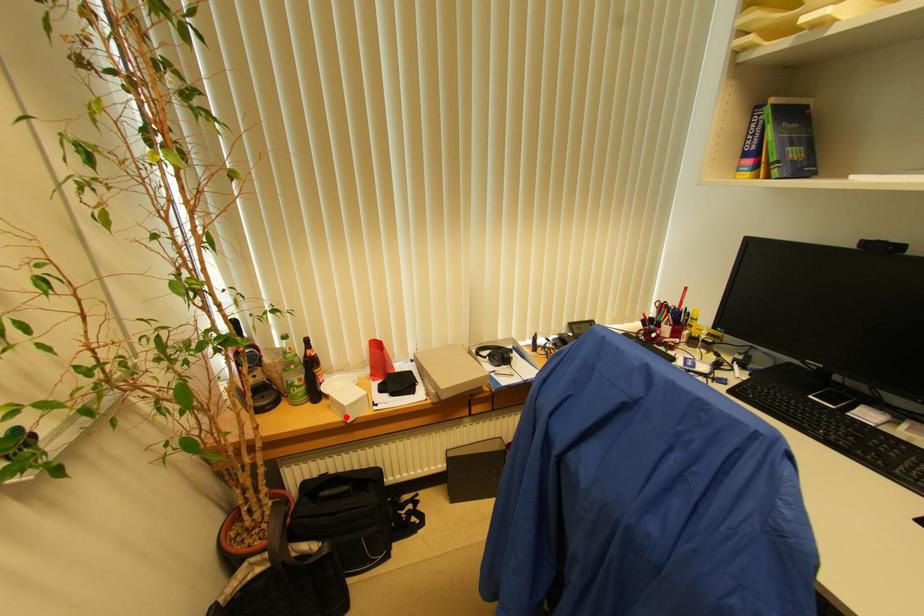
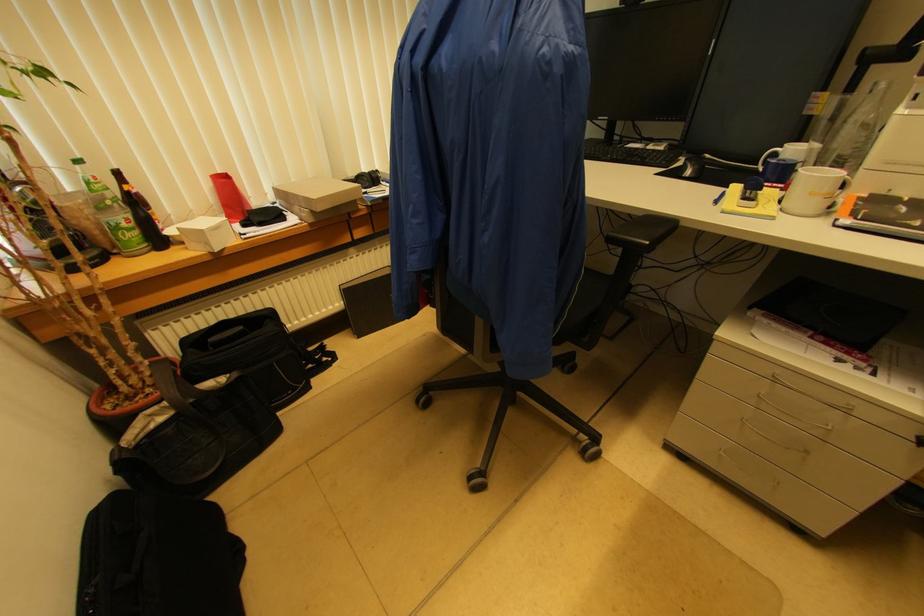
Where in the second image is the point corresponding to the highlighted location from the first image?

(209, 246)